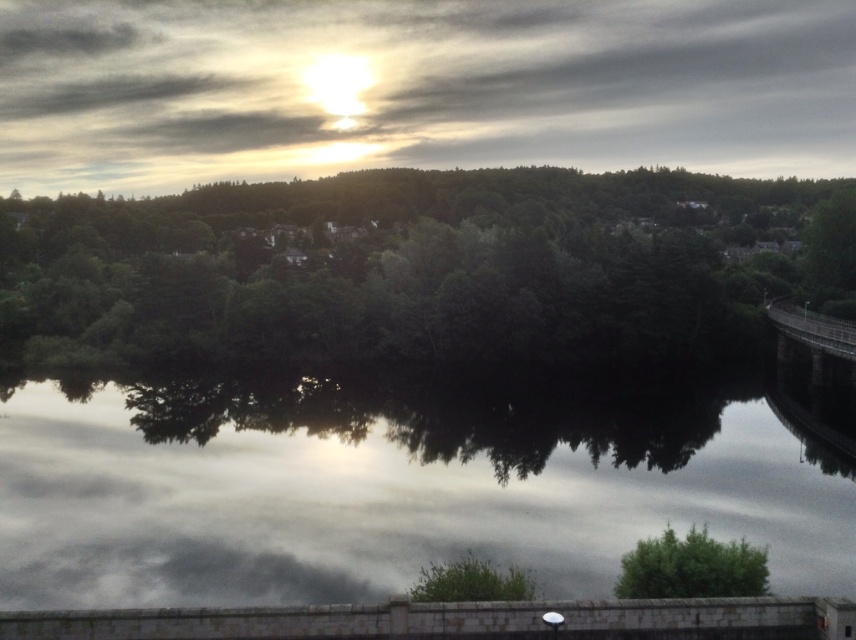
Question: Which object is farther from the camera taking this photo?

Choices:
 (A) reflective glass water at center
 (B) dark gray concrete bridge at right
 (C) green leafy trees at center

Answer: (C)

Question: Is the position of reflective glass water at center less distant than that of dark gray concrete bridge at right?

Choices:
 (A) yes
 (B) no

Answer: (A)

Question: Does green leafy tree at lower right have a greater width compared to dark gray concrete bridge at right?

Choices:
 (A) yes
 (B) no

Answer: (B)

Question: Can you confirm if reflective glass water at center is wider than green leafy trees at center?

Choices:
 (A) yes
 (B) no

Answer: (B)

Question: Which of these objects is positioned farthest from the dark gray concrete bridge at right?

Choices:
 (A) green leafy trees at center
 (B) green leafy tree at lower right
 (C) reflective glass water at center

Answer: (A)

Question: Estimate the real-world distances between objects in this image. Which object is closer to the dark gray concrete bridge at right?

Choices:
 (A) green leafy trees at center
 (B) green leafy tree at lower right

Answer: (B)